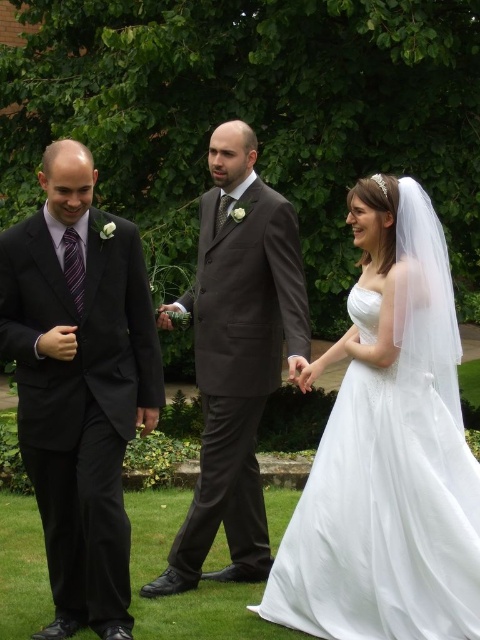
You are standing in the garden where the wedding is taking place. You need to locate the dark gray suit at center. Based on the coordinates provided, where exactly should you look to find it?

The dark gray suit at center is located at the coordinates point (237, 356).

You are a photographer at a wedding and need to position the white satin dress at center and the dark gray suit at center so that both fit within a wide shot. Given their sizes, which one should you adjust to be closer to the camera to ensure both are fully visible?

The white satin dress at center is smaller than the dark gray suit at center. To ensure both fit in the wide shot, you should move the dark gray suit at center closer to the camera so its size matches the white satin dress at center, allowing both to be fully visible in the frame.